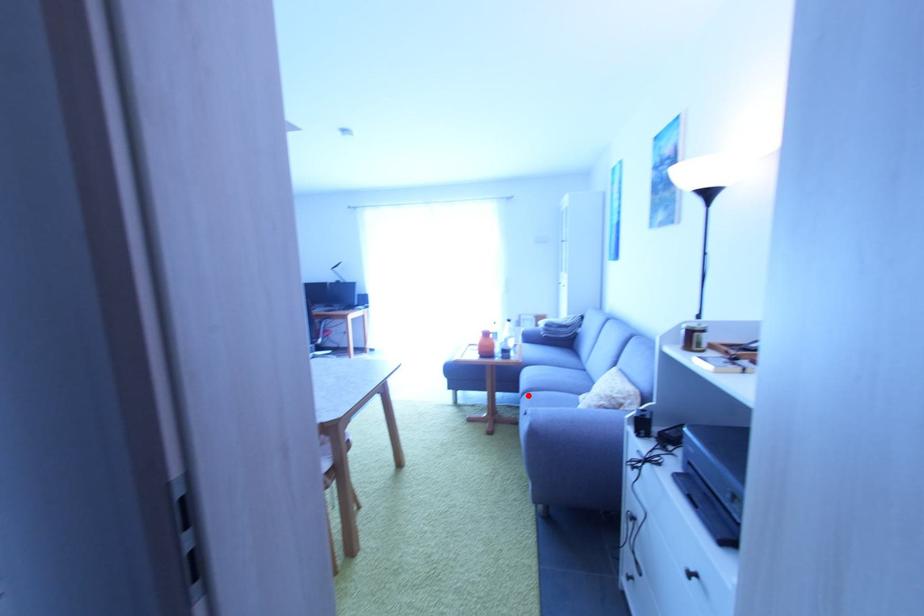
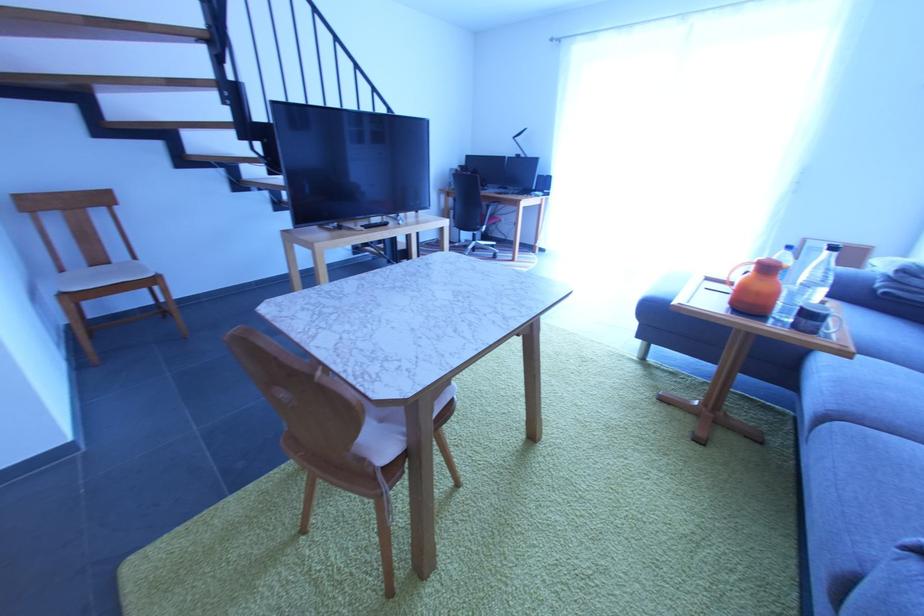
Question: I am providing you with two images of the same scene from different viewpoints. A red point is marked on the first image. Can you still see the location of the red point in image 2?

Choices:
 (A) Yes
 (B) No

Answer: (A)